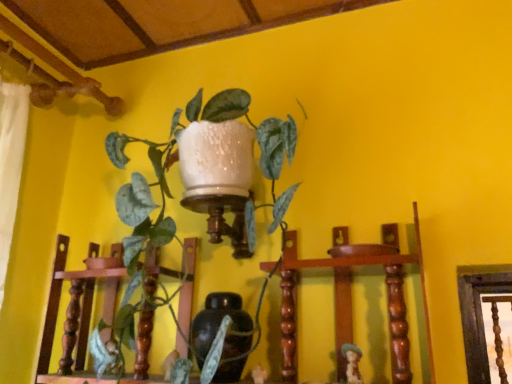
Question: Could green glossy plant at upper center be considered to be inside matte brown vase at center?

Choices:
 (A) yes
 (B) no

Answer: (B)

Question: Can you confirm if matte brown vase at center is shorter than green glossy plant at upper center?

Choices:
 (A) yes
 (B) no

Answer: (A)

Question: Is the depth of matte brown vase at center less than that of green glossy plant at upper center?

Choices:
 (A) yes
 (B) no

Answer: (B)

Question: From the image's perspective, is matte brown vase at center over green glossy plant at upper center?

Choices:
 (A) no
 (B) yes

Answer: (A)

Question: Can you confirm if matte brown vase at center is positioned to the left of green glossy plant at upper center?

Choices:
 (A) no
 (B) yes

Answer: (A)

Question: Based on their sizes in the image, would you say matte brown vase at center is bigger or smaller than green glossy plant at upper center?

Choices:
 (A) big
 (B) small

Answer: (B)

Question: Considering the relative positions of matte brown vase at center and green glossy plant at upper center in the image provided, is matte brown vase at center to the left or to the right of green glossy plant at upper center?

Choices:
 (A) left
 (B) right

Answer: (B)

Question: From the image's perspective, is matte brown vase at center above or below green glossy plant at upper center?

Choices:
 (A) below
 (B) above

Answer: (A)

Question: Which is correct: matte brown vase at center is inside green glossy plant at upper center, or outside of it?

Choices:
 (A) inside
 (B) outside

Answer: (A)

Question: From a real-world perspective, relative to matte brown figurine at lower right, is green glossy plant at upper center vertically above or below?

Choices:
 (A) below
 (B) above

Answer: (B)

Question: Is green glossy plant at upper center in front of or behind matte brown figurine at lower right in the image?

Choices:
 (A) behind
 (B) front

Answer: (B)

Question: From the image's perspective, relative to matte brown figurine at lower right, is green glossy plant at upper center above or below?

Choices:
 (A) below
 (B) above

Answer: (B)

Question: In terms of width, does green glossy plant at upper center look wider or thinner when compared to matte brown figurine at lower right?

Choices:
 (A) thin
 (B) wide

Answer: (B)

Question: In terms of height, does matte brown figurine at lower right look taller or shorter compared to matte brown vase at center?

Choices:
 (A) short
 (B) tall

Answer: (A)

Question: Is matte brown figurine at lower right to the left or to the right of matte brown vase at center in the image?

Choices:
 (A) left
 (B) right

Answer: (B)